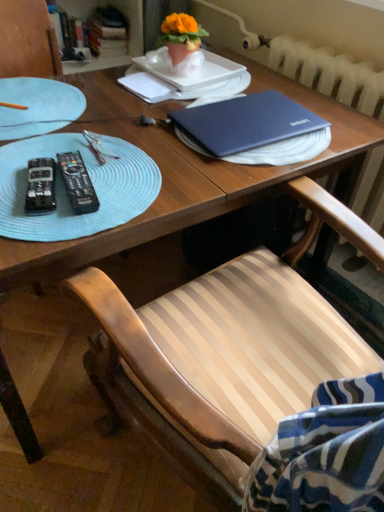
At what (x,y) coordinates should I click in order to perform the action: click on free spot to the left of black plastic remote control at left, which is counted as the second remote control, starting from the left. Please return your answer as a coordinate pair (x, y). This screenshot has height=512, width=384. Looking at the image, I should click on (13, 170).